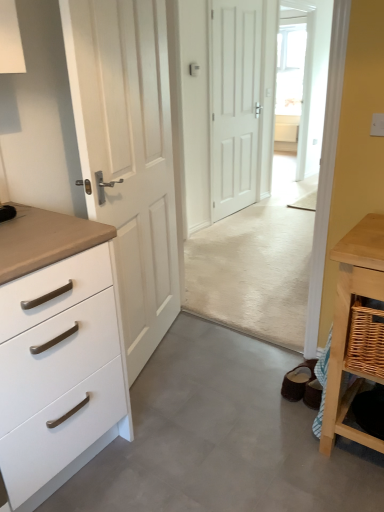
Locate an element on the screen. This screenshot has width=384, height=512. spots to the right of white wood door at left, positioned as the second door in back-to-front order is located at coordinates (223, 355).